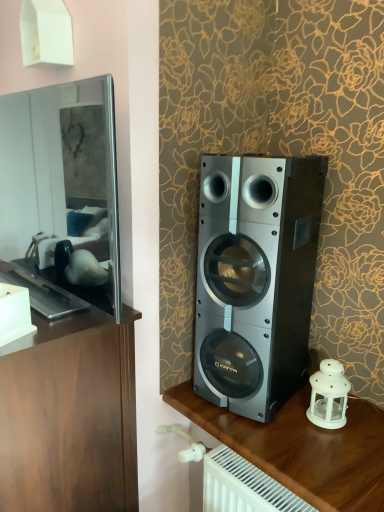
At what (x,y) coordinates should I click in order to perform the action: click on free space in front of silver metallic speaker at center. Please return your answer as a coordinate pair (x, y). Looking at the image, I should click on (291, 440).